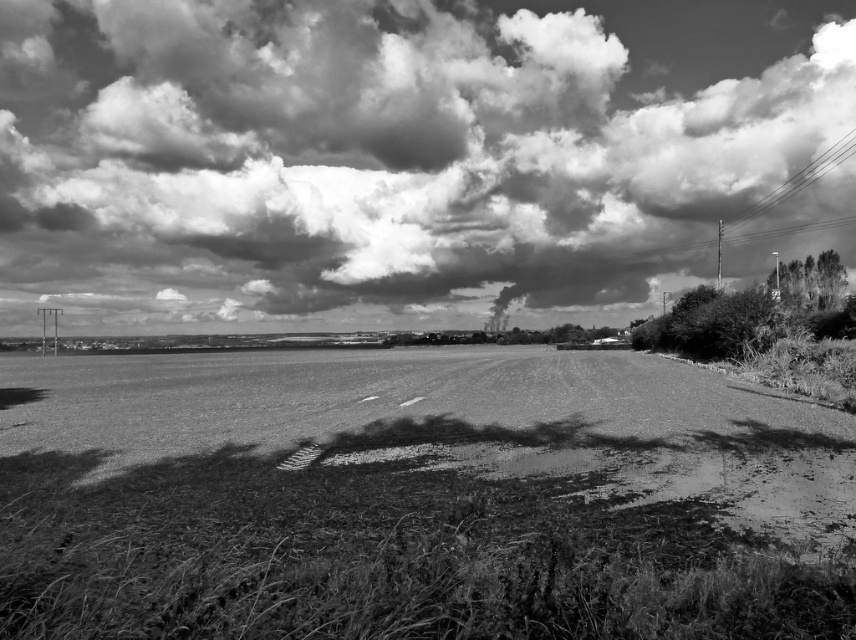
Which of these two, dirt/gritty at center or smooth wire at upper right, stands taller?

smooth wire at upper right is taller.

Where is `dirt/gritty at center`? This screenshot has width=856, height=640. dirt/gritty at center is located at coordinates (446, 426).

At what (x,y) coordinates should I click in order to perform the action: click on dirt/gritty at center. Please return your answer as a coordinate pair (x, y). The height and width of the screenshot is (640, 856). Looking at the image, I should click on (446, 426).

Does cloudy sky at upper center appear on the left side of smooth wire at upper right?

Yes, cloudy sky at upper center is to the left of smooth wire at upper right.

Who is lower down, cloudy sky at upper center or smooth wire at upper right?

smooth wire at upper right

Is point (146, 88) in front of point (794, 177)?

That is True.

Identify the location of cloudy sky at upper center. (409, 156).

Who is higher up, cloudy sky at upper center or dirt/gritty at center?

cloudy sky at upper center is higher up.

Does point (783, 252) lie in front of point (409, 464)?

That is False.

Which is in front, point (340, 22) or point (128, 476)?

Point (128, 476)

Where is `cloudy sky at upper center`? The height and width of the screenshot is (640, 856). cloudy sky at upper center is located at coordinates (409, 156).